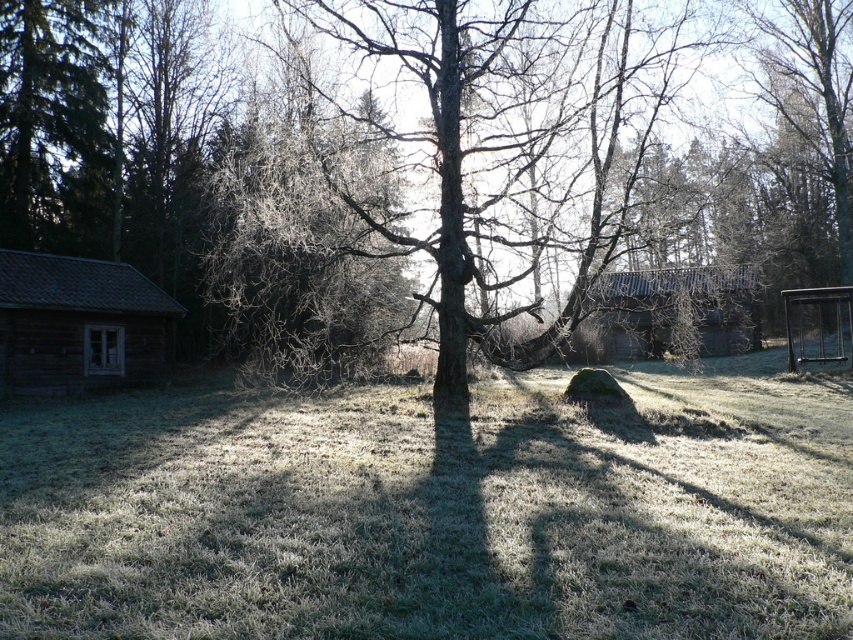
Question: Which of the following is the farthest from the observer?

Choices:
 (A) (381, 120)
 (B) (631, 314)
 (C) (811, 468)
 (D) (45, 253)

Answer: (B)

Question: Is wooden cabin at left wider than rustic wooden cabin at center?

Choices:
 (A) yes
 (B) no

Answer: (B)

Question: Can you confirm if brown rough tree at center is positioned below wooden cabin at left?

Choices:
 (A) yes
 (B) no

Answer: (B)

Question: Which point is closer to the camera?

Choices:
 (A) wooden cabin at left
 (B) brown rough tree at center
 (C) green grassy at center

Answer: (C)

Question: Can you confirm if green grassy at center is thinner than rustic wooden cabin at center?

Choices:
 (A) no
 (B) yes

Answer: (A)

Question: Which point is closer to the camera taking this photo?

Choices:
 (A) (45, 364)
 (B) (636, 305)
 (C) (149, 586)

Answer: (C)